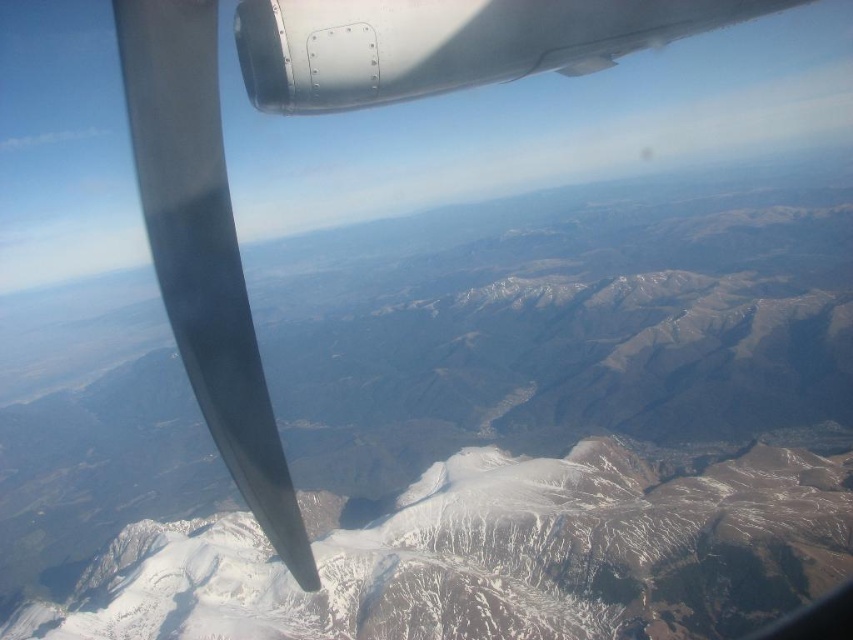
Is white snow-covered mountain at center thinner than metallic gray propeller at upper left?

No.

Which is in front, point (462, 636) or point (236, 300)?

Point (236, 300) is in front.

Find the location of a particular element. The width and height of the screenshot is (853, 640). white snow-covered mountain at center is located at coordinates (488, 556).

Does white snow-covered mountain at center have a greater width compared to metallic gray wing at upper left?

Correct, the width of white snow-covered mountain at center exceeds that of metallic gray wing at upper left.

Can you confirm if white snow-covered mountain at center is thinner than metallic gray wing at upper left?

No.

The height and width of the screenshot is (640, 853). What do you see at coordinates (488, 556) in the screenshot? I see `white snow-covered mountain at center` at bounding box center [488, 556].

Where is `white snow-covered mountain at center`? The image size is (853, 640). white snow-covered mountain at center is located at coordinates (488, 556).

Consider the image. Between metallic gray propeller at upper left and metallic gray wing at upper left, which one has less height?

Standing shorter between the two is metallic gray wing at upper left.

Which is in front, point (140, 60) or point (473, 32)?

Positioned in front is point (140, 60).

This screenshot has width=853, height=640. Find the location of `metallic gray propeller at upper left`. metallic gray propeller at upper left is located at coordinates (202, 252).